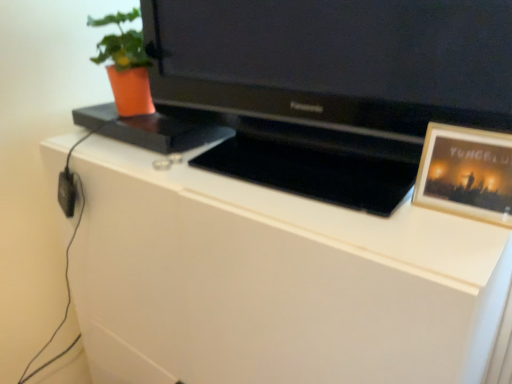
Question: Is orange matte pot at upper left placed right next to black glossy television at center?

Choices:
 (A) yes
 (B) no

Answer: (B)

Question: From the image's perspective, is orange matte pot at upper left below black glossy television at center?

Choices:
 (A) no
 (B) yes

Answer: (A)

Question: Is the depth of orange matte pot at upper left greater than that of black glossy television at center?

Choices:
 (A) no
 (B) yes

Answer: (B)

Question: Does orange matte pot at upper left contain black glossy television at center?

Choices:
 (A) yes
 (B) no

Answer: (B)

Question: Could you tell me if orange matte pot at upper left is turned towards black glossy television at center?

Choices:
 (A) no
 (B) yes

Answer: (A)

Question: Considering the relative positions of orange matte pot at upper left and black glossy television at center in the image provided, is orange matte pot at upper left in front of black glossy television at center?

Choices:
 (A) yes
 (B) no

Answer: (B)

Question: From the image's perspective, does black glossy television at center appear higher than orange matte pot at upper left?

Choices:
 (A) yes
 (B) no

Answer: (B)

Question: Can you confirm if black glossy television at center is positioned to the left of orange matte pot at upper left?

Choices:
 (A) yes
 (B) no

Answer: (B)

Question: From a real-world perspective, is black glossy television at center over orange matte pot at upper left?

Choices:
 (A) yes
 (B) no

Answer: (B)

Question: Does black glossy television at center have a larger size compared to orange matte pot at upper left?

Choices:
 (A) no
 (B) yes

Answer: (B)

Question: Is black glossy television at center surrounding orange matte pot at upper left?

Choices:
 (A) no
 (B) yes

Answer: (A)

Question: Considering the relative sizes of black glossy television at center and orange matte pot at upper left in the image provided, is black glossy television at center shorter than orange matte pot at upper left?

Choices:
 (A) no
 (B) yes

Answer: (A)

Question: Are black glossy television at center and white matte cabinet at center located far from each other?

Choices:
 (A) yes
 (B) no

Answer: (B)